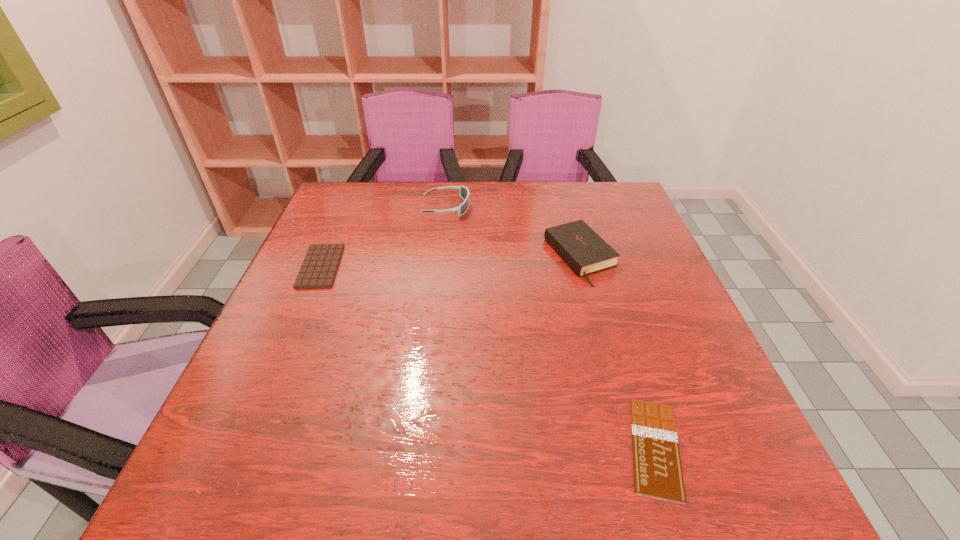
This screenshot has height=540, width=960. Identify the location of free location at the far left corner of the desktop. (333, 208).

Identify the location of vacant position at the near left corner of the desktop. This screenshot has width=960, height=540. (261, 511).

Locate an element on the screen. The width and height of the screenshot is (960, 540). vacant space at the far right corner of the desktop is located at coordinates (601, 202).

The height and width of the screenshot is (540, 960). Find the location of `unoccupied area between the right chocolate bar and the farther chocolate bar`. unoccupied area between the right chocolate bar and the farther chocolate bar is located at coordinates (488, 356).

Where is `vacant area that lies between the Bible and the farthest object`? vacant area that lies between the Bible and the farthest object is located at coordinates (514, 232).

Locate an element on the screen. This screenshot has width=960, height=540. vacant space that is in between the tallest object and the leftmost object is located at coordinates (384, 237).

Locate an element on the screen. This screenshot has width=960, height=540. vacant region between the farthest object and the shorter chocolate bar is located at coordinates (551, 327).

At what (x,y) coordinates should I click in order to perform the action: click on free space between the third shortest object and the goggles. Please return your answer as a coordinate pair (x, y). Looking at the image, I should click on (514, 232).

Image resolution: width=960 pixels, height=540 pixels. Find the location of `free point between the shorter chocolate bar and the third shortest object`. free point between the shorter chocolate bar and the third shortest object is located at coordinates (617, 352).

Where is `free spot between the third object from right to left and the nearest object`? free spot between the third object from right to left and the nearest object is located at coordinates (551, 327).